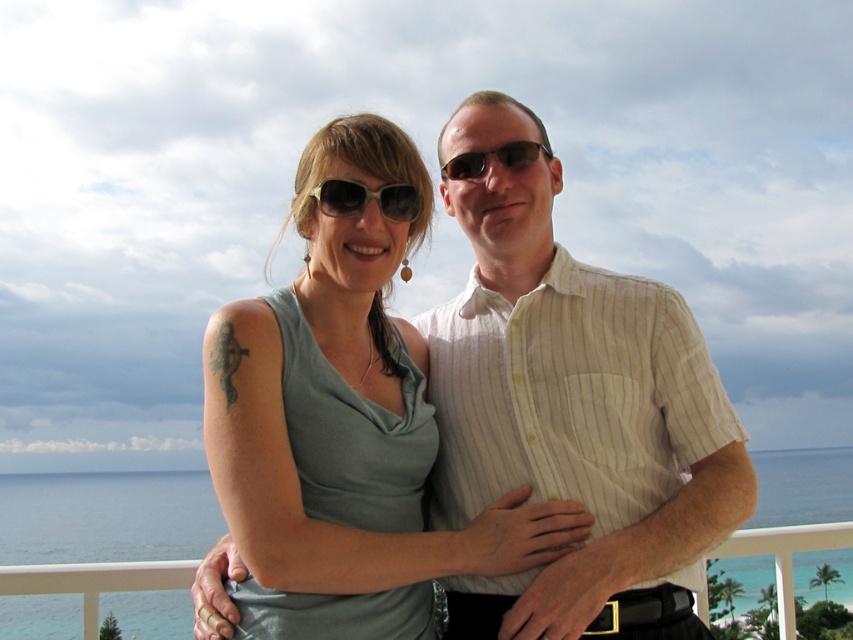
Between white striped shirt at center and matte yellow sunglasses at center, which one appears on the left side from the viewer's perspective?

From the viewer's perspective, matte yellow sunglasses at center appears more on the left side.

Can you confirm if white striped shirt at center is positioned to the left of matte yellow sunglasses at center?

In fact, white striped shirt at center is to the right of matte yellow sunglasses at center.

Who is more forward, (614, 596) or (343, 204)?

Point (614, 596) is in front.

Locate an element on the screen. white striped shirt at center is located at coordinates (576, 424).

Which of these two, matte gray tank top at center or matte black sunglasses at center, stands shorter?

matte black sunglasses at center is shorter.

Is matte gray tank top at center positioned before matte black sunglasses at center?

Yes.

I want to click on matte gray tank top at center, so 361,168.

Is white striped shirt at center bigger than matte gray tank top at center?

Yes.

Can you confirm if white striped shirt at center is positioned above matte gray tank top at center?

No, white striped shirt at center is not above matte gray tank top at center.

Does point (715, 388) come behind point (424, 509)?

No, (715, 388) is closer to viewer.

I want to click on white striped shirt at center, so click(x=576, y=424).